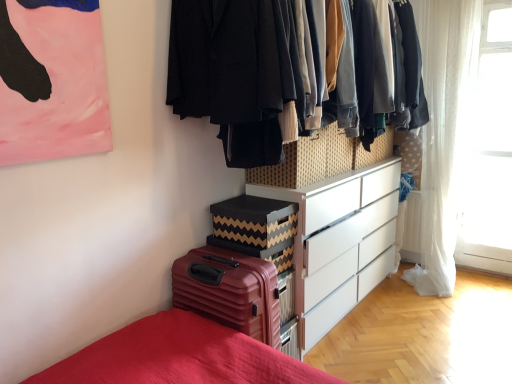
Question: Is white sheer curtain at right to the left of white sheer curtain at right from the viewer's perspective?

Choices:
 (A) yes
 (B) no

Answer: (B)

Question: Does white sheer curtain at right lie in front of white sheer curtain at right?

Choices:
 (A) no
 (B) yes

Answer: (A)

Question: From a real-world perspective, is white sheer curtain at right on top of white sheer curtain at right?

Choices:
 (A) yes
 (B) no

Answer: (B)

Question: Can we say white sheer curtain at right lies outside white sheer curtain at right?

Choices:
 (A) no
 (B) yes

Answer: (B)

Question: Is white sheer curtain at right positioned far away from white sheer curtain at right?

Choices:
 (A) no
 (B) yes

Answer: (A)

Question: Is white sheer curtain at right thinner than white sheer curtain at right?

Choices:
 (A) yes
 (B) no

Answer: (A)

Question: Would you say woven fabric drawer at center is part of white sheer curtain at right's contents?

Choices:
 (A) yes
 (B) no

Answer: (B)

Question: Can you confirm if white sheer curtain at right is positioned to the right of woven fabric drawer at center?

Choices:
 (A) no
 (B) yes

Answer: (B)

Question: Is white sheer curtain at right placed right next to woven fabric drawer at center?

Choices:
 (A) yes
 (B) no

Answer: (B)

Question: Considering the relative sizes of white sheer curtain at right and woven fabric drawer at center in the image provided, is white sheer curtain at right wider than woven fabric drawer at center?

Choices:
 (A) yes
 (B) no

Answer: (B)

Question: From the image's perspective, is white sheer curtain at right under woven fabric drawer at center?

Choices:
 (A) no
 (B) yes

Answer: (A)

Question: From a real-world perspective, is white sheer curtain at right positioned over woven fabric drawer at center based on gravity?

Choices:
 (A) yes
 (B) no

Answer: (B)

Question: Considering the relative sizes of woven fabric drawer at center and white sheer curtain at right in the image provided, is woven fabric drawer at center bigger than white sheer curtain at right?

Choices:
 (A) yes
 (B) no

Answer: (B)